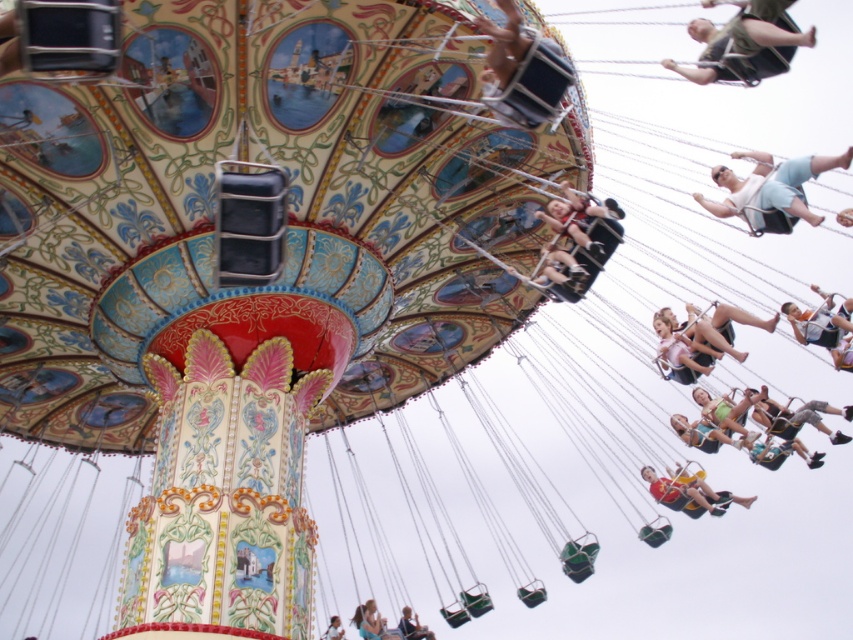
What is the position of the yellow fabric swing at lower right relative to the matte black swing at center?

The yellow fabric swing at lower right is positioned to the right of the matte black swing at center.

You are a maintenance worker at the fairground and need to inspect the yellow fabric swing at lower right and the light brown wooden swing at upper center. Given that you can only carry a 30 meter extension ladder, will you be able to reach both swings from the nearest ground point without moving the ladder?

The distance between the yellow fabric swing at lower right and the light brown wooden swing at upper center is 36.75 meters. Since the ladder is only 30 meters long, it is insufficient to cover the distance between them. Therefore, you would need to move the ladder to reach both swings.

You are a maintenance worker at the fairground and need to inspect both the yellow fabric swing at lower right and the matte black swing at center. If your inspection tool has a 70 feet range, can you inspect both swings from your current position without moving?

The yellow fabric swing at lower right and the matte black swing at center are 69.55 feet apart from each other. Since the distance between them is less than the 70 feet range of your inspection tool, you can inspect both swings without moving.